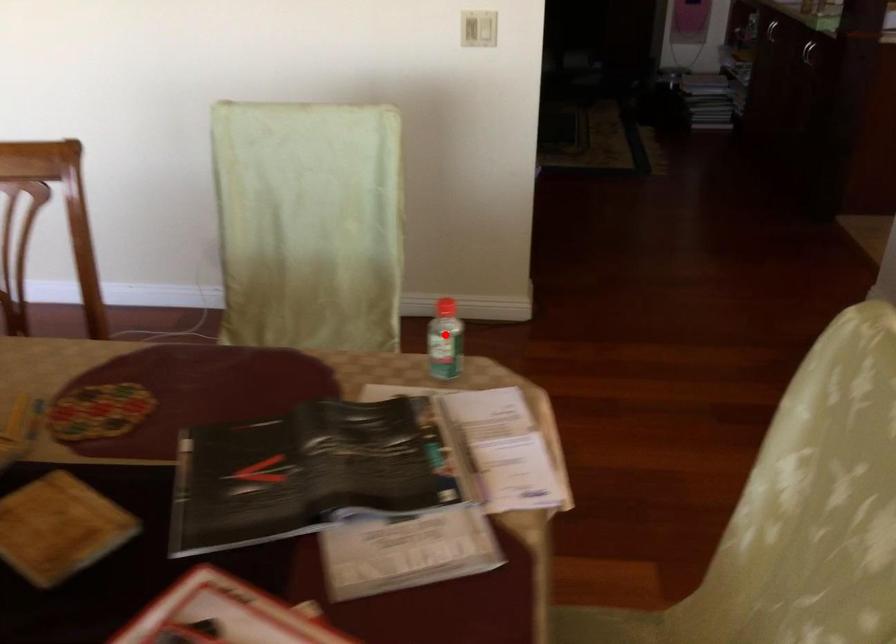
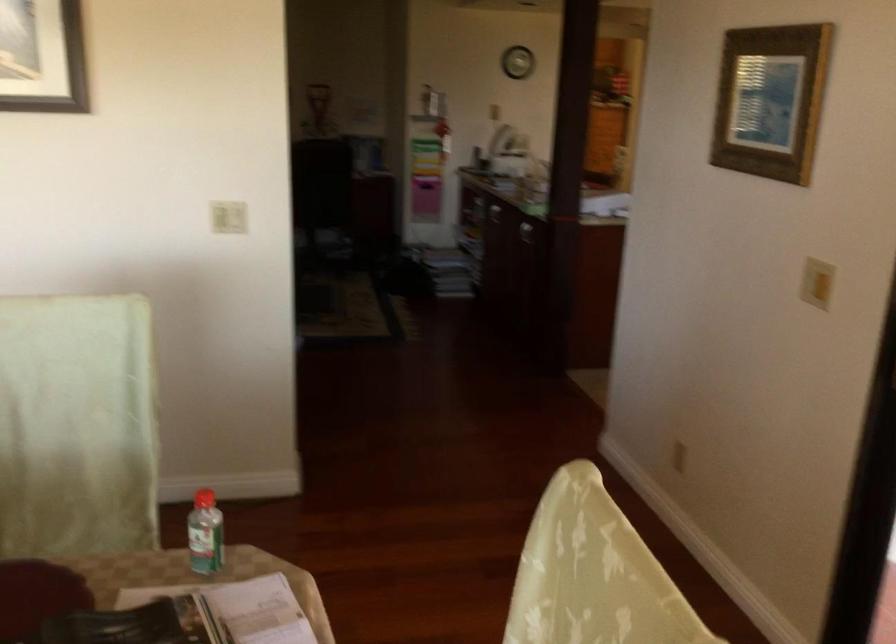
Where in the second image is the point corresponding to the highlighted location from the first image?

(204, 534)